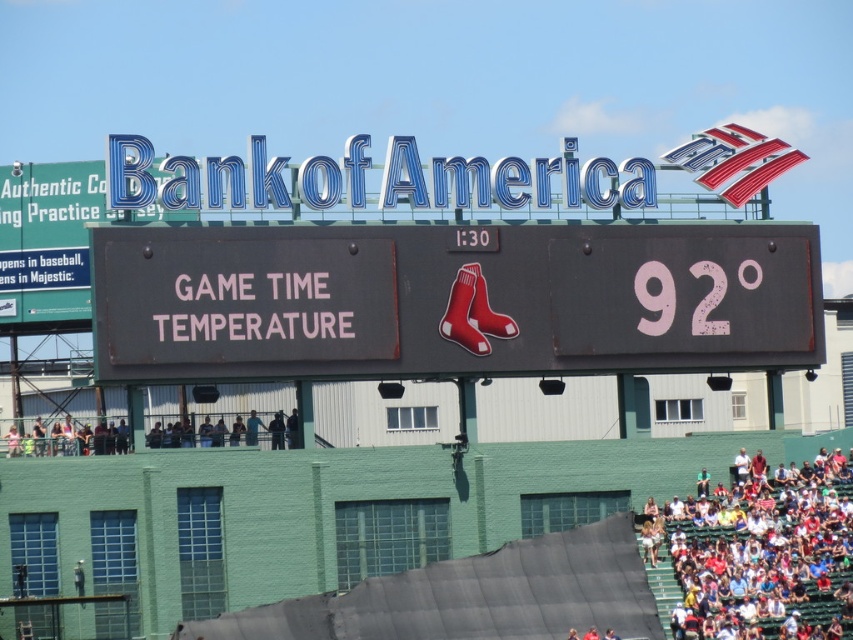
Question: Which of the following is the closest to the observer?

Choices:
 (A) dark gray concrete crowd at lower left
 (B) white fabric seats at lower right
 (C) black matte scoreboard at center

Answer: (B)

Question: Can you confirm if black matte scoreboard at center is thinner than white fabric seats at lower right?

Choices:
 (A) no
 (B) yes

Answer: (A)

Question: Does black matte scoreboard at center lie behind dark gray concrete crowd at lower left?

Choices:
 (A) no
 (B) yes

Answer: (A)

Question: Which of the following is the closest to the observer?

Choices:
 (A) [704, 509]
 (B) [48, 433]

Answer: (A)

Question: Does black matte scoreboard at center lie behind white fabric seats at lower right?

Choices:
 (A) no
 (B) yes

Answer: (B)

Question: Which object is the farthest from the dark gray concrete crowd at lower left?

Choices:
 (A) white fabric seats at lower right
 (B) black matte scoreboard at center

Answer: (A)